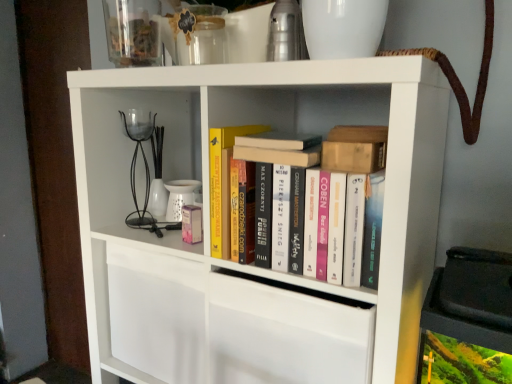
Question: Would you say transparent glass jar at upper center is to the left or to the right of white matte bookshelf at center in the picture?

Choices:
 (A) right
 (B) left

Answer: (B)

Question: From their relative heights in the image, would you say transparent glass jar at upper center is taller or shorter than white matte bookshelf at center?

Choices:
 (A) tall
 (B) short

Answer: (B)

Question: Estimate the real-world distances between objects in this image. Which object is closer to the yellow hardcover book at center?

Choices:
 (A) wooden block at upper right, which is the third book from top to bottom
 (B) hardcover book at center, the 3th book in the bottom-to-top sequence
 (C) white matte bookshelf at center
 (D) hardcover book at center, which ranks as the 1th book in top-to-bottom order
 (E) transparent glass jar at upper center

Answer: (B)

Question: Which object is the farthest from the hardcover book at center, the 2th book positioned from the top?

Choices:
 (A) yellow hardcover book at center
 (B) white matte bookshelf at center
 (C) transparent glass jar at upper center
 (D) wooden block at upper right, which is the third book from top to bottom
 (E) hardcover books at center, the 4th book from the top

Answer: (C)